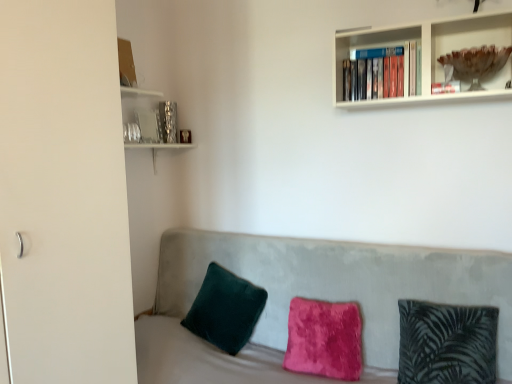
Question: Does velvet couch at center lie behind velvet green pillow at left, which appears as the 3th pillow when viewed from the right?

Choices:
 (A) yes
 (B) no

Answer: (B)

Question: Is velvet couch at center turned away from velvet green pillow at left, which appears as the 3th pillow when viewed from the right?

Choices:
 (A) yes
 (B) no

Answer: (A)

Question: From the image's perspective, is velvet couch at center beneath velvet green pillow at left, which appears as the 3th pillow when viewed from the right?

Choices:
 (A) no
 (B) yes

Answer: (B)

Question: Is velvet couch at center smaller than velvet green pillow at left, which appears as the 3th pillow when viewed from the right?

Choices:
 (A) yes
 (B) no

Answer: (B)

Question: Is velvet couch at center directly adjacent to velvet green pillow at left, placed as the first pillow when sorted from left to right?

Choices:
 (A) no
 (B) yes

Answer: (A)

Question: Is point (238, 284) positioned closer to the camera than point (113, 365)?

Choices:
 (A) farther
 (B) closer

Answer: (A)

Question: From a real-world perspective, is velvet green pillow at left, placed as the first pillow when sorted from left to right, positioned above or below white matte glass door at left?

Choices:
 (A) below
 (B) above

Answer: (A)

Question: Considering the positions of velvet green pillow at left, which appears as the 3th pillow when viewed from the right, and white matte glass door at left in the image, is velvet green pillow at left, which appears as the 3th pillow when viewed from the right, bigger or smaller than white matte glass door at left?

Choices:
 (A) big
 (B) small

Answer: (B)

Question: From their relative heights in the image, would you say velvet green pillow at left, which appears as the 3th pillow when viewed from the right, is taller or shorter than white matte glass door at left?

Choices:
 (A) short
 (B) tall

Answer: (A)

Question: In terms of size, does fuzzy pink pillow at center, the second pillow from the right, appear bigger or smaller than white matte glass door at left?

Choices:
 (A) big
 (B) small

Answer: (B)

Question: From a real-world perspective, is fuzzy pink pillow at center, the second pillow from the right, above or below white matte glass door at left?

Choices:
 (A) below
 (B) above

Answer: (A)

Question: In terms of width, does fuzzy pink pillow at center, positioned as the 2th pillow in left-to-right order, look wider or thinner when compared to white matte glass door at left?

Choices:
 (A) wide
 (B) thin

Answer: (B)

Question: Is fuzzy pink pillow at center, positioned as the 2th pillow in left-to-right order, in front of or behind white matte glass door at left in the image?

Choices:
 (A) behind
 (B) front

Answer: (A)

Question: Considering the positions of velvet couch at center and fuzzy pink pillow at center, the second pillow from the right, in the image, is velvet couch at center taller or shorter than fuzzy pink pillow at center, the second pillow from the right,?

Choices:
 (A) short
 (B) tall

Answer: (B)

Question: Looking at the image, does velvet couch at center seem bigger or smaller compared to fuzzy pink pillow at center, the second pillow from the right?

Choices:
 (A) small
 (B) big

Answer: (B)